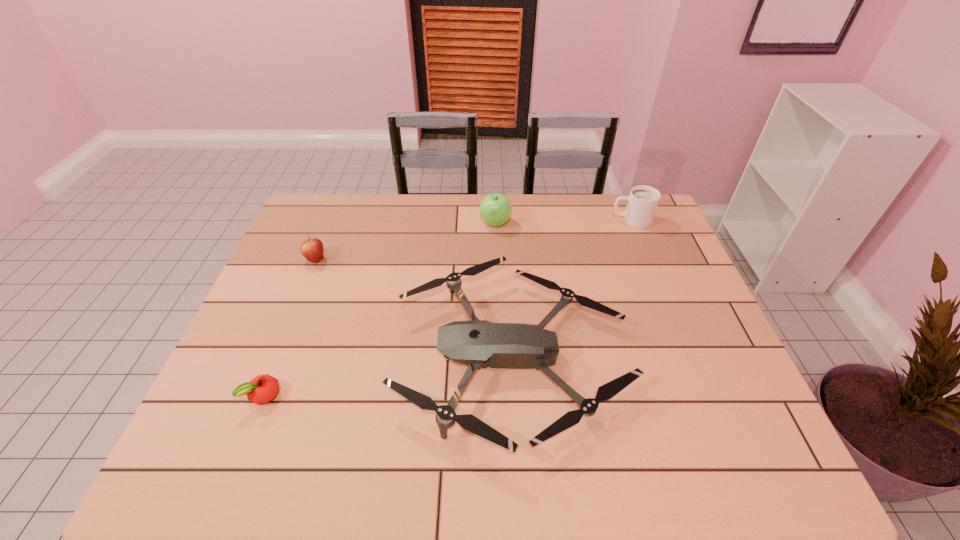
The width and height of the screenshot is (960, 540). What are the coordinates of `blank space at the far edge of the desktop` in the screenshot? It's located at (569, 201).

Where is `free location at the near edge of the desktop`? free location at the near edge of the desktop is located at coordinates (282, 459).

What are the coordinates of `free spot at the left edge of the desktop` in the screenshot? It's located at (285, 314).

The width and height of the screenshot is (960, 540). I want to click on vacant area at the right edge, so click(x=655, y=272).

The image size is (960, 540). I want to click on vacant space at the near right corner of the desktop, so click(708, 472).

Locate an element on the screen. vacant space that is in between the nearest apple and the second nearest apple is located at coordinates (290, 327).

Find the location of `free space between the shortest apple and the second nearest apple`. free space between the shortest apple and the second nearest apple is located at coordinates (290, 327).

Image resolution: width=960 pixels, height=540 pixels. In order to click on free space that is in between the cappuccino and the farthest apple in this screenshot , I will do `click(564, 222)`.

This screenshot has width=960, height=540. Find the location of `free space between the second farthest apple and the drone`. free space between the second farthest apple and the drone is located at coordinates (414, 308).

This screenshot has height=540, width=960. I want to click on vacant area between the farthest apple and the drone, so click(504, 289).